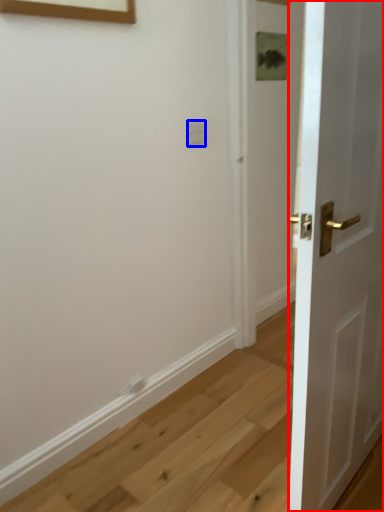
Question: Which object is closer to the camera taking this photo, door (highlighted by a red box) or electric outlet (highlighted by a blue box)?

Choices:
 (A) door
 (B) electric outlet

Answer: (A)